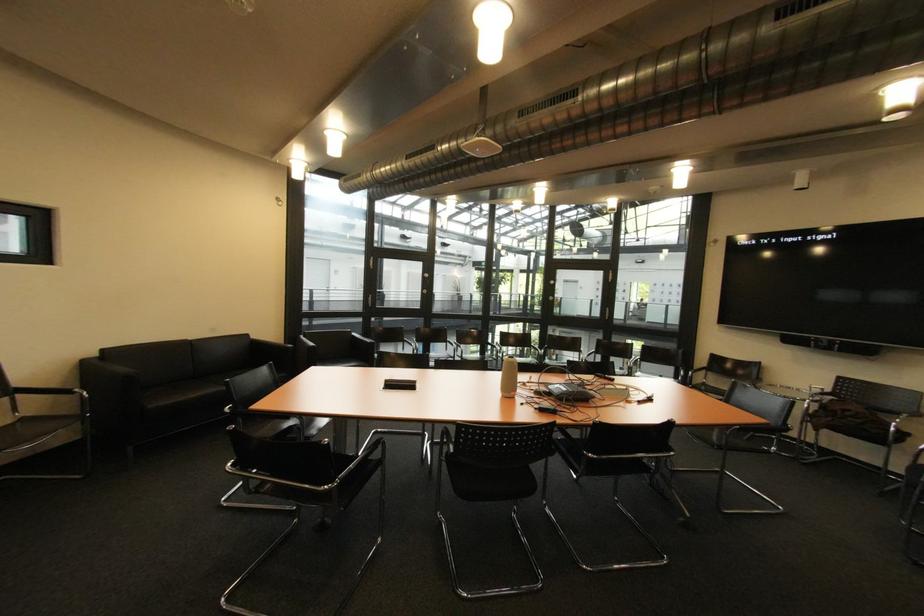
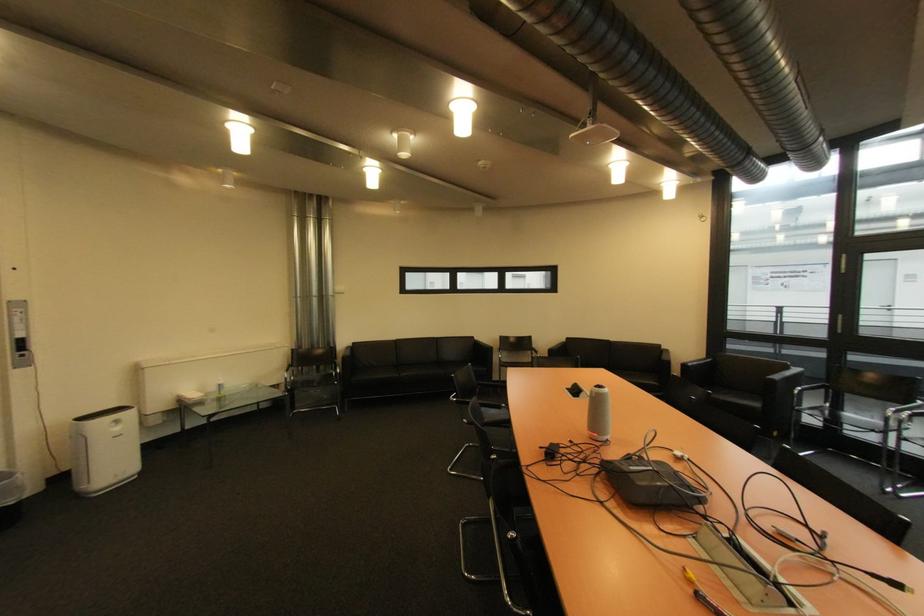
Find the pixel in the second image that matches (x=391, y=387) in the first image.

(578, 389)